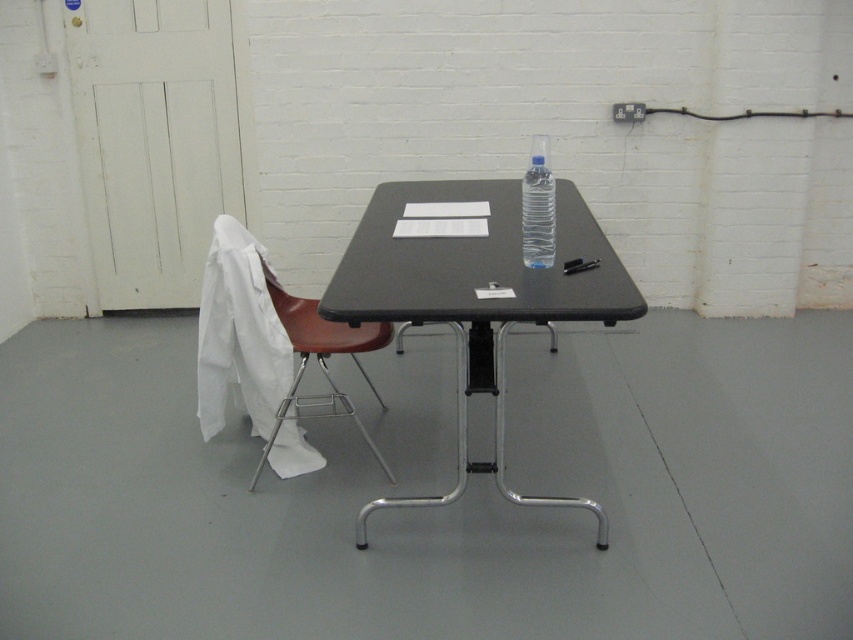
Image resolution: width=853 pixels, height=640 pixels. What do you see at coordinates (477, 300) in the screenshot? I see `black plastic table at center` at bounding box center [477, 300].

Which is in front, point (519, 209) or point (521, 230)?

Point (521, 230) is in front.

Where is `black plastic table at center`? This screenshot has height=640, width=853. black plastic table at center is located at coordinates (477, 300).

Which is behind, point (199, 326) or point (538, 243)?

The point (199, 326) is behind.

Can you confirm if white fabric at left is bigger than clear plastic bottle at center?

Yes.

Is point (285, 454) more distant than point (538, 262)?

Yes, point (285, 454) is farther from viewer.

This screenshot has height=640, width=853. I want to click on white fabric at left, so click(x=239, y=333).

Who is taller, matte brown chair at left or clear plastic bottle at center?

matte brown chair at left

Which is in front, point (296, 342) or point (541, 220)?

Point (541, 220) is more forward.

Find the location of a particular element. The height and width of the screenshot is (640, 853). matte brown chair at left is located at coordinates (320, 362).